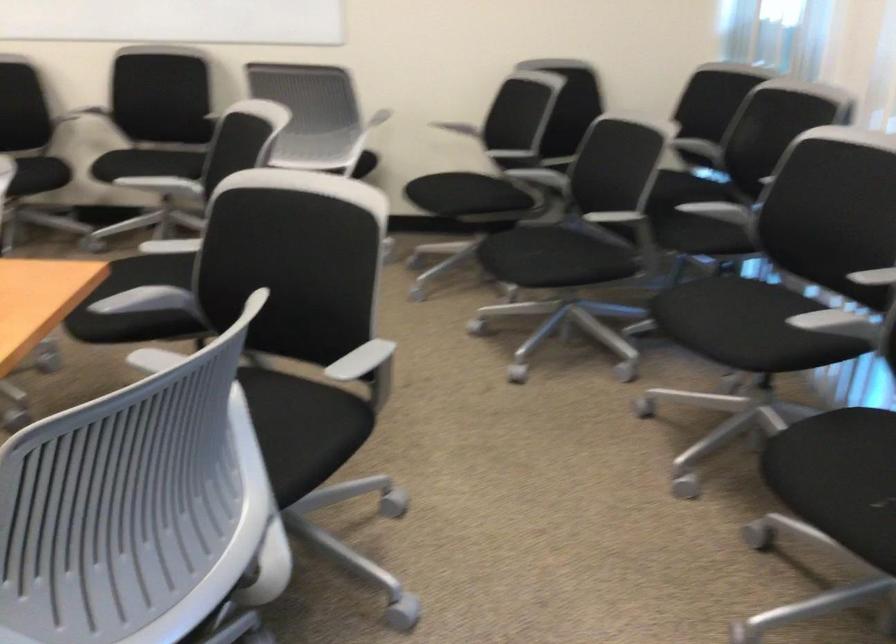
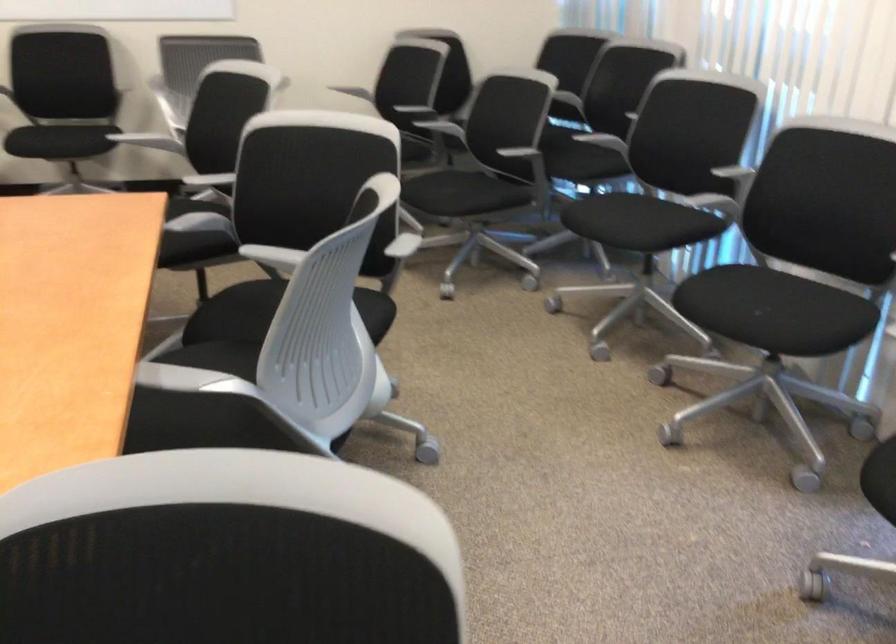
Locate, in the second image, the point that corresponds to point 537,151 in the first image.

(432, 107)